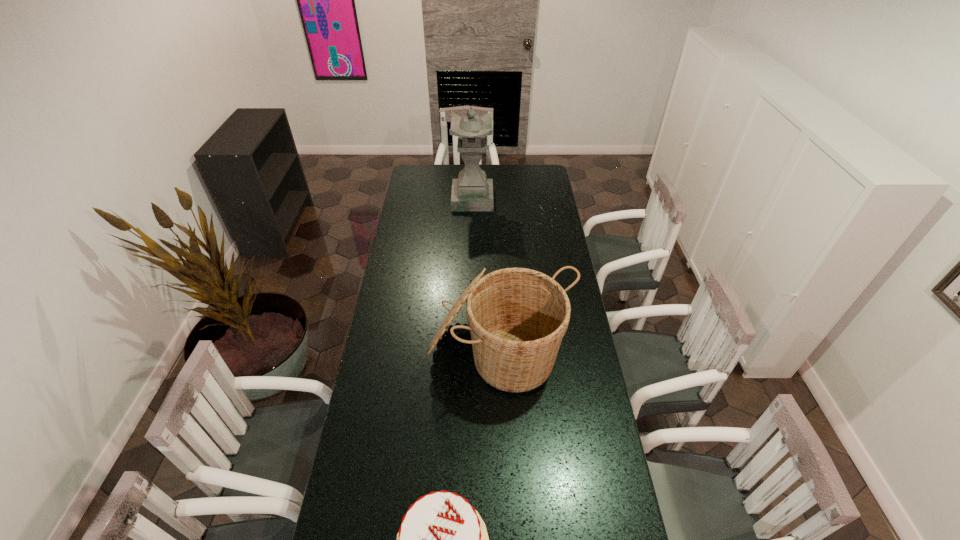
Find the location of a particular element. The width and height of the screenshot is (960, 540). the tallest object is located at coordinates (472, 191).

This screenshot has height=540, width=960. In order to click on sculpture in this screenshot , I will do `click(472, 191)`.

Identify the location of the second farthest object. The image size is (960, 540). (517, 317).

This screenshot has height=540, width=960. Identify the location of the second tallest object. (517, 317).

This screenshot has width=960, height=540. I want to click on blank space located 0.220m at the front opening of the farthest object, so click(x=532, y=199).

Locate an element on the screen. This screenshot has height=540, width=960. vacant region located 0.120m on the left of the second farthest object is located at coordinates (400, 350).

Locate an element on the screen. This screenshot has height=540, width=960. object that is at the right edge is located at coordinates (517, 317).

The image size is (960, 540). In order to click on vacant area at the far edge in this screenshot , I will do `click(447, 185)`.

The width and height of the screenshot is (960, 540). In order to click on vacant area at the left edge of the desktop in this screenshot , I will do `click(367, 387)`.

In order to click on vacant space at the right edge in this screenshot , I will do `click(529, 206)`.